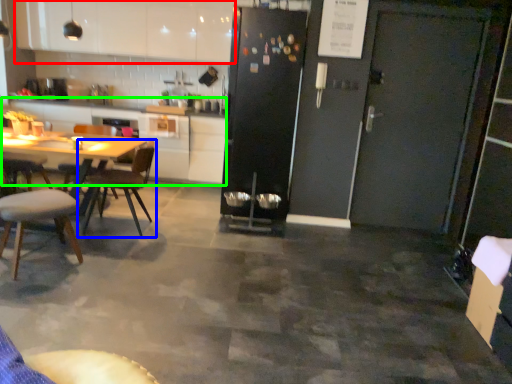
Question: Which object is positioned closest to cabinetry (highlighted by a red box)? Select from chair (highlighted by a blue box) and counter top (highlighted by a green box).

Choices:
 (A) chair
 (B) counter top

Answer: (B)